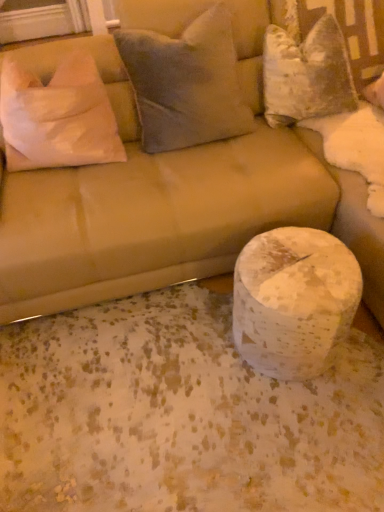
Question: From the image's perspective, relative to white fabric pillow at left, marked as the third pillow in a right-to-left arrangement, is suede beige couch at center above or below?

Choices:
 (A) above
 (B) below

Answer: (A)

Question: From a real-world perspective, relative to white fabric pillow at left, marked as the third pillow in a right-to-left arrangement, is suede beige couch at center vertically above or below?

Choices:
 (A) below
 (B) above

Answer: (A)

Question: Which of these objects is positioned closest to the velvety gray pillow at upper center, placed as the 2th pillow when sorted from left to right?

Choices:
 (A) velvet white pillow at upper right, positioned as the first pillow in right-to-left order
 (B) white fabric pillow at left, which ranks as the first pillow in left-to-right order
 (C) suede beige couch at center
 (D) white speckled marble at lower right

Answer: (C)

Question: Considering the real-world distances, which object is closest to the velvety gray pillow at upper center, which is the 2th pillow from right to left?

Choices:
 (A) white speckled marble at lower right
 (B) velvet white pillow at upper right, positioned as the first pillow in right-to-left order
 (C) white fabric pillow at left, which ranks as the first pillow in left-to-right order
 (D) suede beige couch at center

Answer: (D)